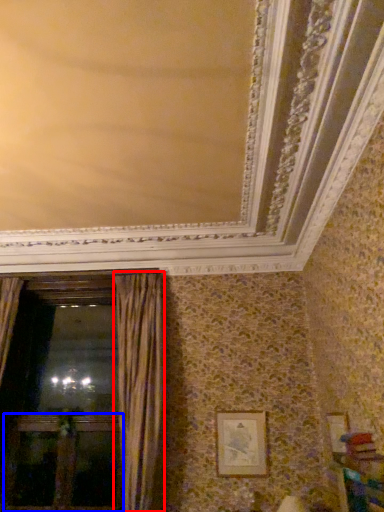
Question: Which object appears closest to the camera in this image, curtain (highlighted by a red box) or screen door (highlighted by a blue box)?

Choices:
 (A) curtain
 (B) screen door

Answer: (A)